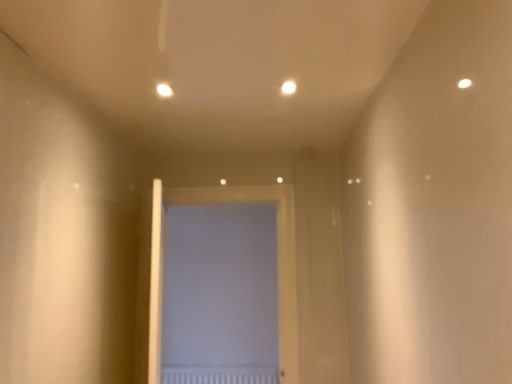
Where is `white textured radiator at center`? Image resolution: width=512 pixels, height=384 pixels. white textured radiator at center is located at coordinates (220, 375).

You are a GUI agent. You are given a task and a screenshot of the screen. Output one action in this format:
    pyautogui.click(x=<x>, y=<y>)
    Task: Click on the white matte door at center
    This screenshot has width=512, height=384.
    Given the screenshot: What is the action you would take?
    (278, 262)

Where is `white textured radiator at center`? The height and width of the screenshot is (384, 512). white textured radiator at center is located at coordinates (220, 375).

Which is less distant, (295, 87) or (157, 85)?

Point (295, 87) is farther from the camera than point (157, 85).

Measure the distance from white glossy light at upper center, the 1th light when ordered from right to left, to matte white light at upper center, acting as the first light starting from the left.

21.70 inches.

Does white glossy light at upper center, acting as the 2th light starting from the left, turn towards matte white light at upper center, the second light viewed from the right?

No.

Does white glossy light at upper center, the 1th light when ordered from right to left, have a lesser width compared to matte white light at upper center, acting as the first light starting from the left?

Correct, the width of white glossy light at upper center, the 1th light when ordered from right to left, is less than that of matte white light at upper center, acting as the first light starting from the left.

Does point (196, 375) lie in front of point (148, 361)?

No, (196, 375) is further to viewer.

Can you confirm if white textured radiator at center is wider than white matte door at center?

No, white textured radiator at center is not wider than white matte door at center.

Consider the image. Does white textured radiator at center have a larger size compared to white matte door at center?

Actually, white textured radiator at center might be smaller than white matte door at center.

Is white textured radiator at center surrounding white matte door at center?

That's incorrect, white matte door at center is not inside white textured radiator at center.

From a real-world perspective, who is located higher, white glossy light at upper center, the 1th light when ordered from right to left, or white matte door at center?

white glossy light at upper center, the 1th light when ordered from right to left, from a real-world perspective.

Looking at their sizes, would you say white glossy light at upper center, acting as the 2th light starting from the left, is wider or thinner than white matte door at center?

white glossy light at upper center, acting as the 2th light starting from the left, is thinner than white matte door at center.

Could white matte door at center be considered to be inside white glossy light at upper center, acting as the 2th light starting from the left?

Definitely not — white matte door at center is not inside white glossy light at upper center, acting as the 2th light starting from the left.

How far apart are white glossy light at upper center, the 1th light when ordered from right to left, and white matte door at center?

white glossy light at upper center, the 1th light when ordered from right to left, and white matte door at center are 4.17 feet apart from each other.

Are white textured radiator at center and matte white light at upper center, the second light viewed from the right, making contact?

They are not placed beside each other.

From the picture: Who is shorter, white textured radiator at center or matte white light at upper center, the second light viewed from the right?

Standing shorter between the two is matte white light at upper center, the second light viewed from the right.

The height and width of the screenshot is (384, 512). I want to click on radiator below the matte white light at upper center, the second light viewed from the right (from the image's perspective), so click(x=220, y=375).

Relative to matte white light at upper center, the second light viewed from the right, is white textured radiator at center in front or behind?

white textured radiator at center is behind matte white light at upper center, the second light viewed from the right.

Is matte white light at upper center, the second light viewed from the right, positioned far away from white textured radiator at center?

That's right, there is a large distance between matte white light at upper center, the second light viewed from the right, and white textured radiator at center.

From the image's perspective, is matte white light at upper center, the second light viewed from the right, positioned above or below white textured radiator at center?

matte white light at upper center, the second light viewed from the right, is situated higher than white textured radiator at center in the image.

Is white textured radiator at center at the back of matte white light at upper center, acting as the first light starting from the left?

matte white light at upper center, acting as the first light starting from the left, does not have its back to white textured radiator at center.

Who is smaller, white matte door at center or matte white light at upper center, acting as the first light starting from the left?

With smaller size is matte white light at upper center, acting as the first light starting from the left.

From the image's perspective, who appears lower, white matte door at center or matte white light at upper center, the second light viewed from the right?

white matte door at center is shown below in the image.

Which is behind, white matte door at center or matte white light at upper center, the second light viewed from the right?

white matte door at center is behind.

Is the surface of white matte door at center in direct contact with matte white light at upper center, the second light viewed from the right?

No, white matte door at center is not making contact with matte white light at upper center, the second light viewed from the right.

Based on the photo, would you consider white textured radiator at center to be distant from white glossy light at upper center, the 1th light when ordered from right to left?

Yes, white textured radiator at center is far from white glossy light at upper center, the 1th light when ordered from right to left.

Which point is more forward, (252, 380) or (293, 93)?

The point (293, 93) is closer to the camera.

Is white textured radiator at center taller than white glossy light at upper center, acting as the 2th light starting from the left?

Indeed, white textured radiator at center has a greater height compared to white glossy light at upper center, acting as the 2th light starting from the left.

Is white textured radiator at center wider than white glossy light at upper center, the 1th light when ordered from right to left?

No.

In order to click on light that appears below the white glossy light at upper center, the 1th light when ordered from right to left (from the image's perspective) in this screenshot , I will do `click(164, 90)`.

Find the location of a particular element. This screenshot has height=384, width=512. radiator behind the white matte door at center is located at coordinates (220, 375).

When comparing their distances from matte white light at upper center, acting as the first light starting from the left, does white matte door at center or white textured radiator at center seem further?

white textured radiator at center lies further to matte white light at upper center, acting as the first light starting from the left, than the other object.

Looking at the image, which one is located closer to white textured radiator at center, white matte door at center or white glossy light at upper center, the 1th light when ordered from right to left?

The object closer to white textured radiator at center is white matte door at center.

Based on their spatial positions, is matte white light at upper center, acting as the first light starting from the left, or white textured radiator at center closer to white matte door at center?

matte white light at upper center, acting as the first light starting from the left, is positioned closer to the anchor white matte door at center.

Based on their spatial positions, is white matte door at center or matte white light at upper center, the second light viewed from the right, closer to white glossy light at upper center, the 1th light when ordered from right to left?

matte white light at upper center, the second light viewed from the right, is closer to white glossy light at upper center, the 1th light when ordered from right to left.

From the image, which object appears to be nearer to white matte door at center, white glossy light at upper center, acting as the 2th light starting from the left, or matte white light at upper center, acting as the first light starting from the left?

Among the two, white glossy light at upper center, acting as the 2th light starting from the left, is located nearer to white matte door at center.

Considering their positions, is white textured radiator at center positioned further to matte white light at upper center, the second light viewed from the right, than white matte door at center?

Based on the image, white textured radiator at center appears to be further to matte white light at upper center, the second light viewed from the right.

When comparing their distances from white glossy light at upper center, acting as the 2th light starting from the left, does matte white light at upper center, the second light viewed from the right, or white textured radiator at center seem further?

white textured radiator at center is further to white glossy light at upper center, acting as the 2th light starting from the left.

From the image, which object appears to be farther from white textured radiator at center, matte white light at upper center, the second light viewed from the right, or white glossy light at upper center, acting as the 2th light starting from the left?

The object further to white textured radiator at center is white glossy light at upper center, acting as the 2th light starting from the left.

The height and width of the screenshot is (384, 512). In order to click on light between white glossy light at upper center, acting as the 2th light starting from the left, and white textured radiator at center, in the vertical direction in this screenshot , I will do `click(164, 90)`.

Locate an element on the screen. light between white glossy light at upper center, acting as the 2th light starting from the left, and white matte door at center vertically is located at coordinates (164, 90).

The image size is (512, 384). I want to click on door between matte white light at upper center, acting as the first light starting from the left, and white textured radiator at center from top to bottom, so click(278, 262).

Locate an element on the screen. The height and width of the screenshot is (384, 512). door between white glossy light at upper center, the 1th light when ordered from right to left, and white textured radiator at center, in the vertical direction is located at coordinates (278, 262).